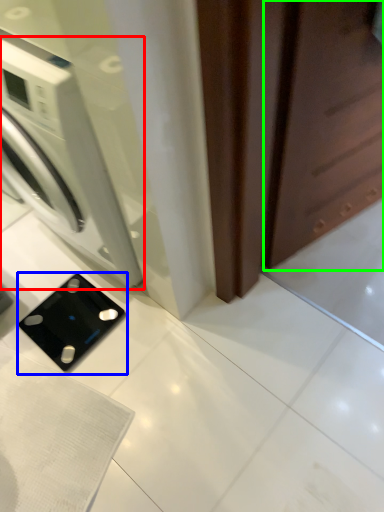
Question: Which object is positioned farthest from washing machine (highlighted by a red box)? Select from appliance (highlighted by a blue box) and screen door (highlighted by a green box).

Choices:
 (A) appliance
 (B) screen door

Answer: (B)